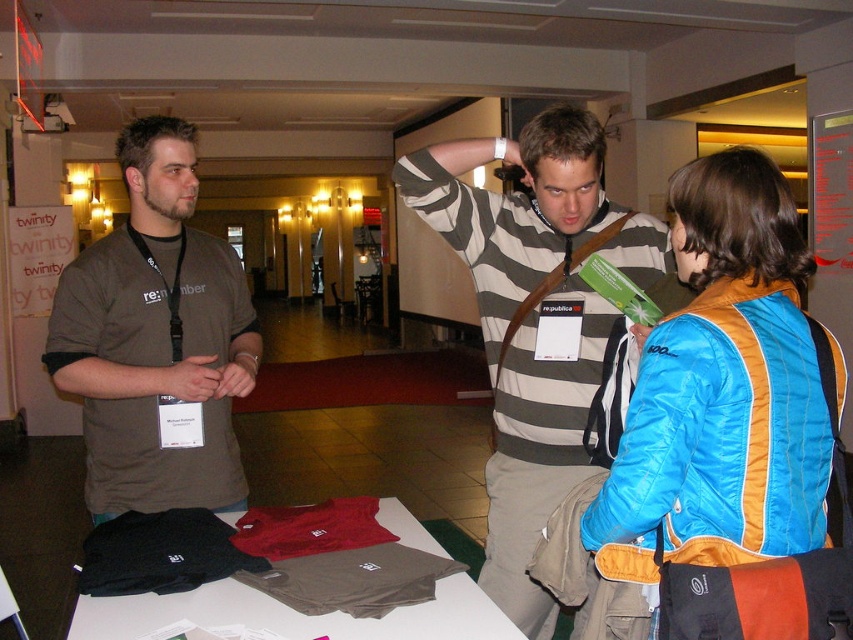
You are a participant at the event and need to locate the blue down jacket at center and striped cotton shirt at center. According to the scene, which item is positioned higher?

The blue down jacket at center is located above the striped cotton shirt at center, so it is positioned higher.